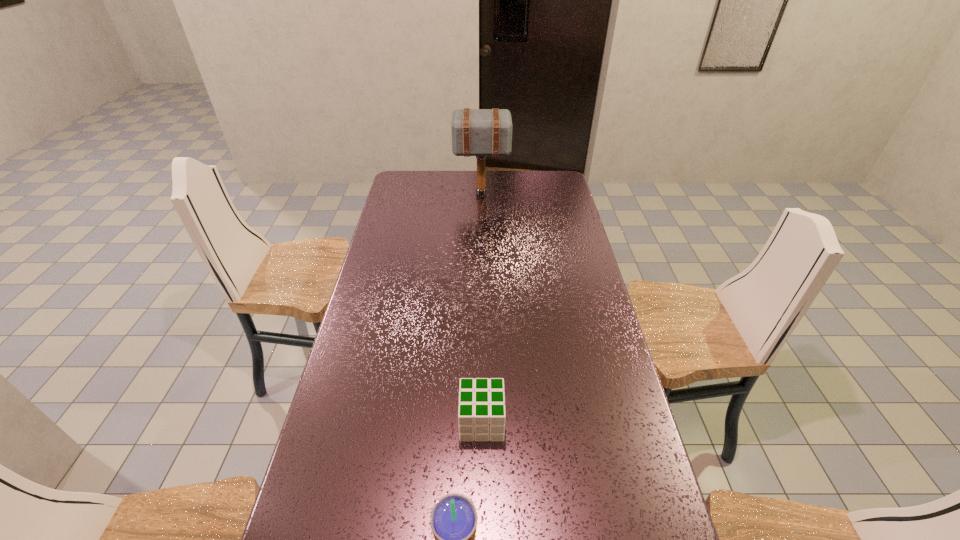
At what (x,y) coordinates should I click in order to perform the action: click on object at the far edge. Please return your answer as a coordinate pair (x, y). Looking at the image, I should click on (475, 132).

The width and height of the screenshot is (960, 540). In order to click on free space at the far edge in this screenshot , I will do `click(490, 183)`.

This screenshot has width=960, height=540. In the image, there is a desktop. In order to click on vacant space at the left edge in this screenshot , I will do `click(363, 409)`.

At what (x,y) coordinates should I click in order to perform the action: click on vacant area at the right edge of the desktop. Please return your answer as a coordinate pair (x, y). This screenshot has width=960, height=540. Looking at the image, I should click on (563, 198).

In the image, there is a desktop. What are the coordinates of `free space at the far left corner` in the screenshot? It's located at click(397, 191).

The width and height of the screenshot is (960, 540). Identify the location of free space between the second nearest object and the mallet. (482, 308).

This screenshot has width=960, height=540. What are the coordinates of `empty space between the shortest object and the tallest object` in the screenshot? It's located at (482, 308).

You are a GUI agent. You are given a task and a screenshot of the screen. Output one action in this format:
    pyautogui.click(x=<x>, y=<y>)
    Task: Click on the vacant area between the tallest object and the shortest object
    Image resolution: width=960 pixels, height=540 pixels.
    Given the screenshot: What is the action you would take?
    pyautogui.click(x=482, y=308)

Identify the location of unoccupied area between the shortest object and the mallet. The image size is (960, 540). (482, 308).

Find the location of a particular element. Image resolution: width=960 pixels, height=540 pixels. blank region between the tallest object and the cube is located at coordinates (482, 308).